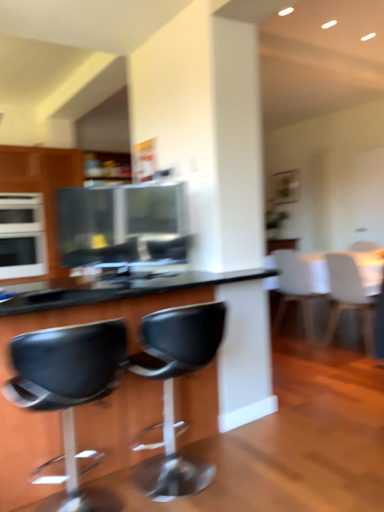
Question: From the image's perspective, is white glossy table at upper right, which is the second table from front to back, beneath white matte chair at right, which ranks as the second chair in right-to-left order?

Choices:
 (A) yes
 (B) no

Answer: (B)

Question: Is white glossy table at upper right, placed as the 2th table when sorted from left to right, positioned far away from white matte chair at right, the first chair positioned from the back?

Choices:
 (A) yes
 (B) no

Answer: (B)

Question: Is white glossy table at upper right, which is the second table from front to back, to the left of white matte chair at right, which ranks as the second chair in right-to-left order, from the viewer's perspective?

Choices:
 (A) no
 (B) yes

Answer: (A)

Question: From a real-world perspective, is white glossy table at upper right, which is counted as the 1th table, starting from the back, below white matte chair at right, the first chair positioned from the back?

Choices:
 (A) yes
 (B) no

Answer: (B)

Question: Considering the relative sizes of white glossy table at upper right, placed as the 2th table when sorted from left to right, and white matte chair at right, the first chair positioned from the back, in the image provided, is white glossy table at upper right, placed as the 2th table when sorted from left to right, wider than white matte chair at right, the first chair positioned from the back,?

Choices:
 (A) no
 (B) yes

Answer: (B)

Question: Do you think black leather stool at lower left, placed as the fourth chair when sorted from right to left, is within black plastic table at center, the second table positioned from the right, or outside of it?

Choices:
 (A) inside
 (B) outside

Answer: (A)

Question: From the image's perspective, relative to black plastic table at center, which appears as the first table when viewed from the left, is black leather stool at lower left, which is counted as the 4th chair, starting from the back, above or below?

Choices:
 (A) below
 (B) above

Answer: (A)

Question: Is black leather stool at lower left, the first chair from the left, taller or shorter than black plastic table at center, the second table positioned from the right?

Choices:
 (A) tall
 (B) short

Answer: (B)

Question: In terms of width, does black leather stool at lower left, which is counted as the 4th chair, starting from the back, look wider or thinner when compared to black plastic table at center, the 2th table positioned from the back?

Choices:
 (A) thin
 (B) wide

Answer: (A)

Question: In terms of width, does black plastic table at center, the second table positioned from the right, look wider or thinner when compared to white glossy table at upper right, marked as the first table in a right-to-left arrangement?

Choices:
 (A) wide
 (B) thin

Answer: (B)

Question: Is point (18, 431) closer or farther from the camera than point (314, 259)?

Choices:
 (A) closer
 (B) farther

Answer: (A)

Question: From the image's perspective, is black plastic table at center, the 2th table positioned from the back, above or below white glossy table at upper right, which is counted as the 1th table, starting from the back?

Choices:
 (A) below
 (B) above

Answer: (A)

Question: Is black plastic table at center, which appears as the first table when viewed from the left, inside the boundaries of white glossy table at upper right, placed as the 2th table when sorted from left to right, or outside?

Choices:
 (A) outside
 (B) inside

Answer: (A)

Question: Based on their sizes in the image, would you say black plastic chair at center, the 3th chair from the right, is bigger or smaller than black plastic table at center, the second table positioned from the right?

Choices:
 (A) small
 (B) big

Answer: (A)

Question: In terms of width, does black plastic chair at center, acting as the 2th chair starting from the left, look wider or thinner when compared to black plastic table at center, the second table positioned from the right?

Choices:
 (A) wide
 (B) thin

Answer: (B)